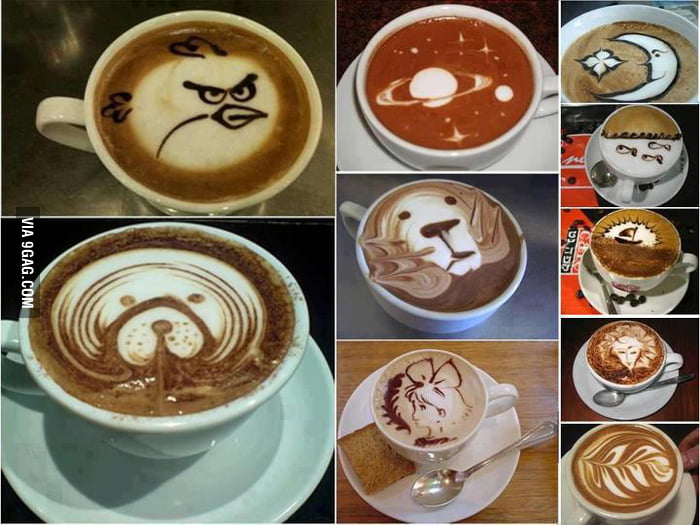
The height and width of the screenshot is (525, 700). I want to click on spoons, so click(x=612, y=398), click(x=592, y=262), click(x=602, y=173), click(x=434, y=485).